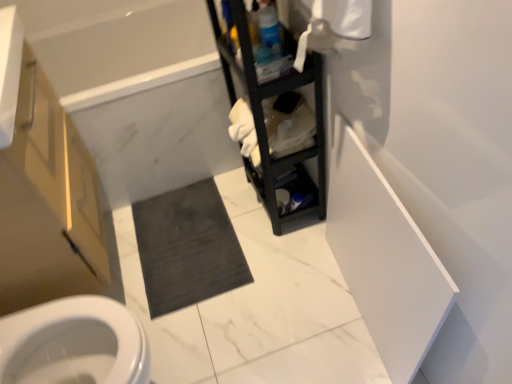
Question: From the image's perspective, is dark gray carpet at center located beneath matte wood cabinet at left?

Choices:
 (A) yes
 (B) no

Answer: (A)

Question: Can we say dark gray carpet at center lies outside matte wood cabinet at left?

Choices:
 (A) yes
 (B) no

Answer: (A)

Question: Does dark gray carpet at center have a lesser height compared to matte wood cabinet at left?

Choices:
 (A) no
 (B) yes

Answer: (B)

Question: Is dark gray carpet at center oriented away from matte wood cabinet at left?

Choices:
 (A) no
 (B) yes

Answer: (A)

Question: From the image's perspective, does dark gray carpet at center appear higher than matte wood cabinet at left?

Choices:
 (A) no
 (B) yes

Answer: (A)

Question: Is matte wood cabinet at left inside the boundaries of white marble bathtub at upper left, or outside?

Choices:
 (A) inside
 (B) outside

Answer: (B)

Question: In terms of height, does matte wood cabinet at left look taller or shorter compared to white marble bathtub at upper left?

Choices:
 (A) tall
 (B) short

Answer: (A)

Question: Is point 15,210 positioned closer to the camera than point 221,120?

Choices:
 (A) closer
 (B) farther

Answer: (A)

Question: From a real-world perspective, is matte wood cabinet at left above or below white marble bathtub at upper left?

Choices:
 (A) below
 (B) above

Answer: (B)

Question: Considering the positions of dark gray carpet at center and white marble bathtub at upper left in the image, is dark gray carpet at center taller or shorter than white marble bathtub at upper left?

Choices:
 (A) short
 (B) tall

Answer: (A)

Question: Based on their positions, is dark gray carpet at center located to the left or right of white marble bathtub at upper left?

Choices:
 (A) right
 (B) left

Answer: (A)

Question: Do you think dark gray carpet at center is within white marble bathtub at upper left, or outside of it?

Choices:
 (A) outside
 (B) inside

Answer: (A)

Question: Considering their positions, is dark gray carpet at center located in front of or behind white marble bathtub at upper left?

Choices:
 (A) behind
 (B) front

Answer: (A)

Question: In terms of width, does white marble bathtub at upper left look wider or thinner when compared to dark gray carpet at center?

Choices:
 (A) thin
 (B) wide

Answer: (B)

Question: Is point (134, 87) positioned closer to the camera than point (204, 205)?

Choices:
 (A) closer
 (B) farther

Answer: (A)